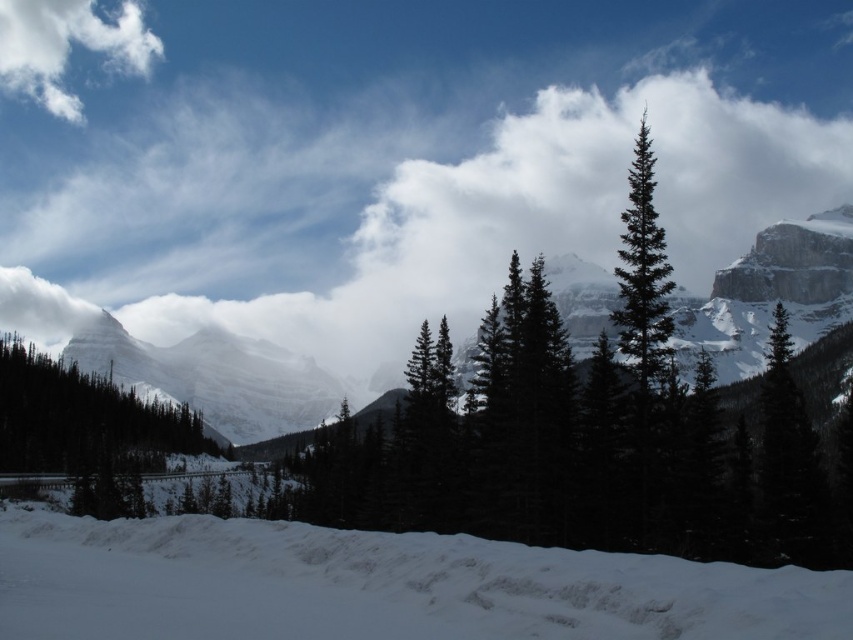
Between point (341, 620) and point (817, 547), which one is positioned behind?

The point (817, 547) is more distant.

Image resolution: width=853 pixels, height=640 pixels. Describe the element at coordinates (379, 586) in the screenshot. I see `white snow at lower center` at that location.

Is point (347, 552) positioned before point (769, 522)?

Yes, point (347, 552) is closer to viewer.

Find the location of `white snow at lower center`. white snow at lower center is located at coordinates (379, 586).

Who is taller, dark green textured evergreen at right or green matte evergreen tree at center?

green matte evergreen tree at center is taller.

Who is lower down, dark green textured evergreen at right or green matte evergreen tree at center?

Positioned lower is dark green textured evergreen at right.

What do you see at coordinates (788, 464) in the screenshot? Image resolution: width=853 pixels, height=640 pixels. I see `dark green textured evergreen at right` at bounding box center [788, 464].

You are a GUI agent. You are given a task and a screenshot of the screen. Output one action in this format:
    pyautogui.click(x=<x>, y=<y>)
    Task: Click on the dark green textured evergreen at right
    The image size is (853, 640).
    Given the screenshot: What is the action you would take?
    pyautogui.click(x=788, y=464)

Between snowy granite mountain at center and dark green textured pine tree at left, which one has less height?

dark green textured pine tree at left

What do you see at coordinates (213, 378) in the screenshot? Image resolution: width=853 pixels, height=640 pixels. I see `snowy granite mountain at center` at bounding box center [213, 378].

Find the location of a particular element. snowy granite mountain at center is located at coordinates (213, 378).